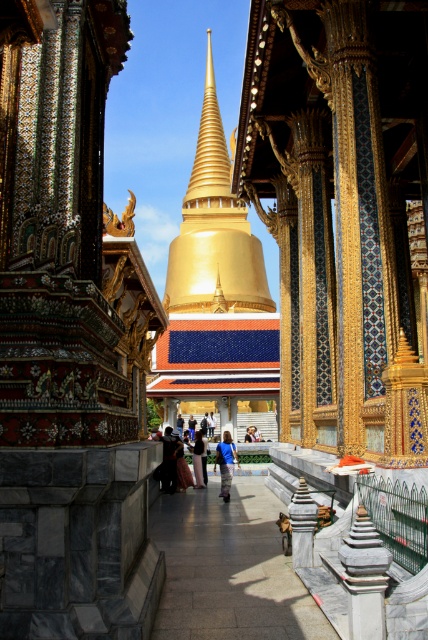
You are a photographer planning to take a picture of the Grand Palace temple complex. You want to ensure that the black velvet dress at center is perfectly centered in your shot. Given the coordinates provided in the description, where should you position the dress relative to the stupa and other structures?

The black velvet dress at center is located at point coordinates, so you should position it at the center of your frame to capture it alongside the towering golden stupa and other ornate structures in the background.

You are a tourist standing in front of the temple complex. You notice the gold polished spire at center and the blue fabric bag at center. Which object is closer to you?

→ The gold polished spire at center is closer to you because it is further to the viewer than the blue fabric bag at center.

You are a photographer planning to capture the grandeur of the temple complex. You notice two central elements in your frame, the blue denim jeans at center and the blue fabric person at center. Which of these two objects is wider in your composition?

The blue denim jeans at center is wider than the blue fabric person at center.